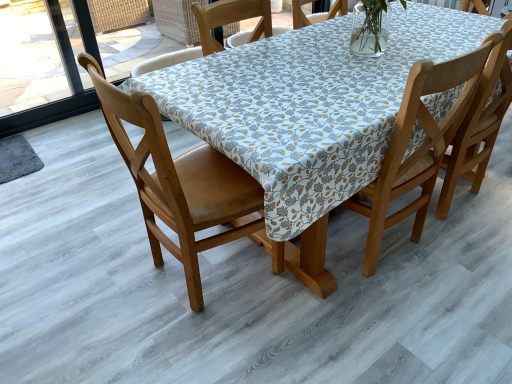
Question: Considering the positions of wooden chair at center, which is counted as the first chair, starting from the right, and wooden chair at left, which is the first chair from left to right, in the image, is wooden chair at center, which is counted as the first chair, starting from the right, wider or thinner than wooden chair at left, which is the first chair from left to right,?

Choices:
 (A) wide
 (B) thin

Answer: (B)

Question: Would you say wooden chair at center, the 2th chair in the left-to-right sequence, is inside or outside wooden chair at left, which is the first chair from left to right?

Choices:
 (A) inside
 (B) outside

Answer: (B)

Question: Based on their positions, is wooden chair at center, the 2th chair in the left-to-right sequence, located to the left or right of wooden chair at left, positioned as the 2th chair in right-to-left order?

Choices:
 (A) left
 (B) right

Answer: (B)

Question: Is wooden chair at left, positioned as the 2th chair in right-to-left order, inside the boundaries of wooden chair at center, the 2th chair in the left-to-right sequence, or outside?

Choices:
 (A) inside
 (B) outside

Answer: (B)

Question: Is wooden chair at left, positioned as the 2th chair in right-to-left order, wider or thinner than wooden chair at center, the 2th chair in the left-to-right sequence?

Choices:
 (A) thin
 (B) wide

Answer: (B)

Question: From a real-world perspective, is wooden chair at left, positioned as the 2th chair in right-to-left order, above or below wooden chair at center, which is counted as the first chair, starting from the right?

Choices:
 (A) below
 (B) above

Answer: (A)

Question: Considering their positions, is wooden chair at left, which is the first chair from left to right, located in front of or behind wooden chair at center, which is counted as the first chair, starting from the right?

Choices:
 (A) behind
 (B) front

Answer: (B)